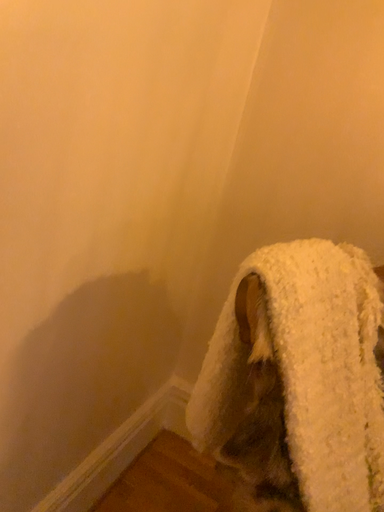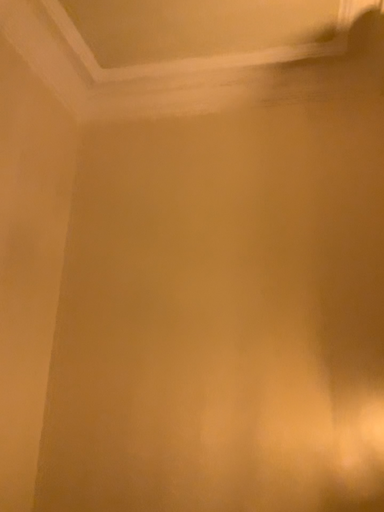
Question: Which way did the camera rotate in the video?

Choices:
 (A) rotated upward
 (B) rotated downward

Answer: (A)